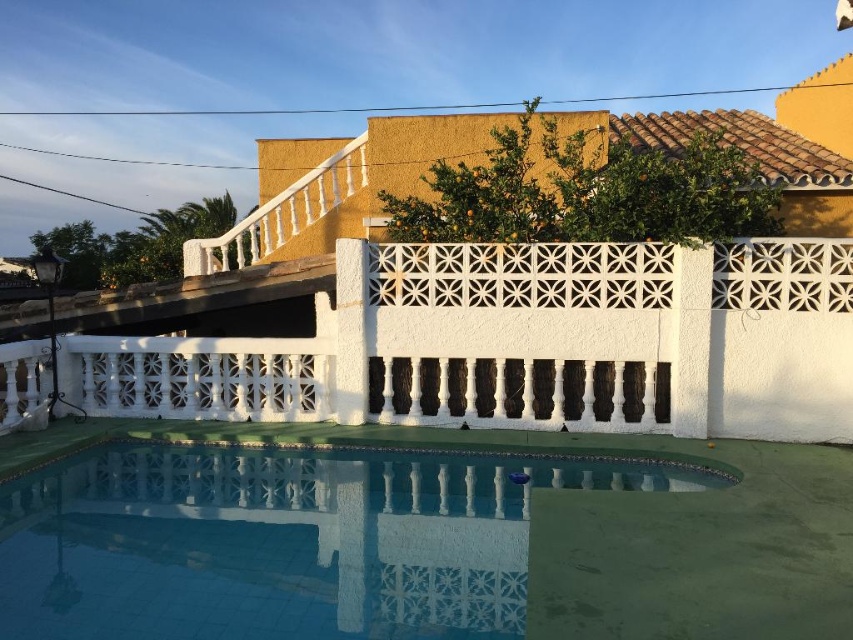
Is yellow stucco villa at upper center thinner than blue tile swimming pool at lower center?

No, yellow stucco villa at upper center is not thinner than blue tile swimming pool at lower center.

Between point (717, 348) and point (494, 560), which one is positioned in front?

Positioned in front is point (494, 560).

Is point (260, 400) in front of point (456, 592)?

No, it is behind (456, 592).

This screenshot has height=640, width=853. What are the coordinates of `yellow stucco villa at upper center` in the screenshot? It's located at (502, 307).